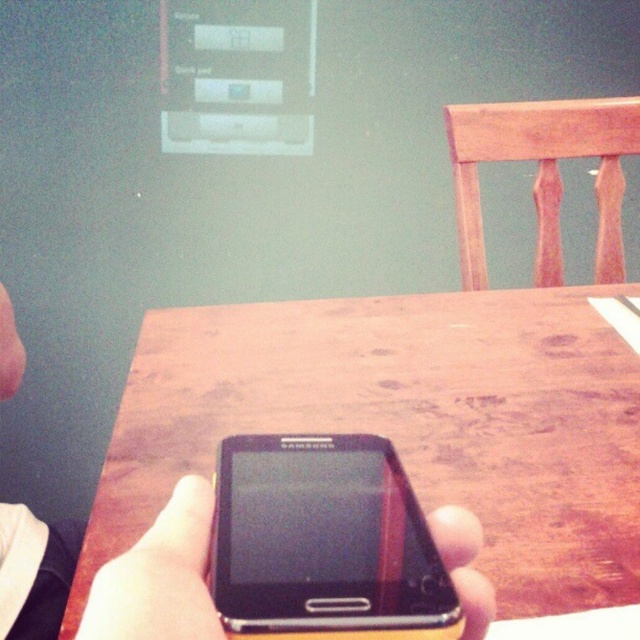
In the scene shown: You are standing in front of the wooden table at center and the black matte phone at center. Which object is positioned to the right side?

The wooden table at center is to the right of the black matte phone at center.

You are a photographer adjusting your camera settings to capture the scene. You notice two points in the image at coordinates point (522, 452) and point (128, 609). Which point is closer to your camera lens?

Point (522, 452) is further to the camera than point (128, 609), so the point closer to the camera lens is point (128, 609).